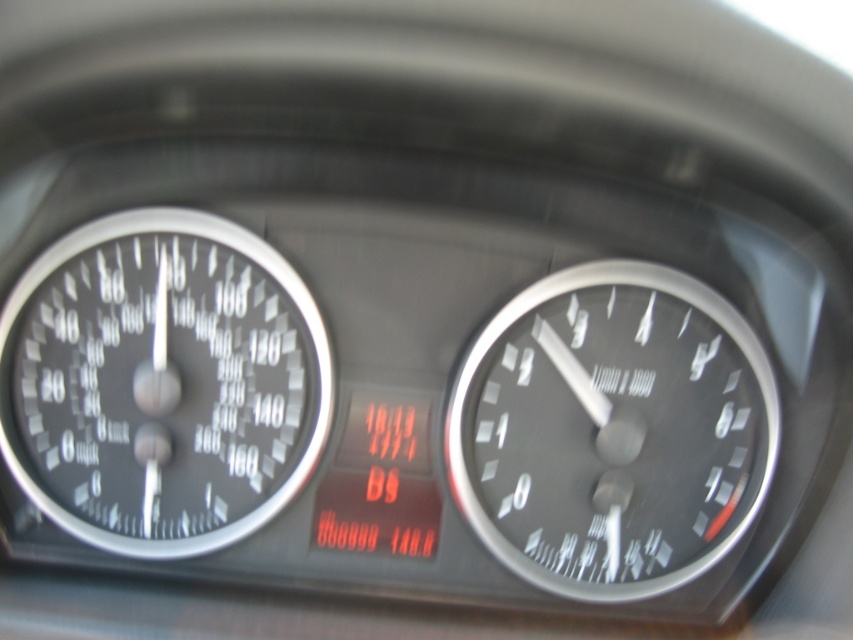
Can you confirm if matte black speedometer at left is bigger than black metallic speedometer at right?

Actually, matte black speedometer at left might be smaller than black metallic speedometer at right.

Is point (212, 282) behind point (511, 449)?

No.

Which is in front, point (248, 508) or point (698, 385)?

Point (698, 385) is in front.

Where is `matte black speedometer at left`? The width and height of the screenshot is (853, 640). matte black speedometer at left is located at coordinates (161, 381).